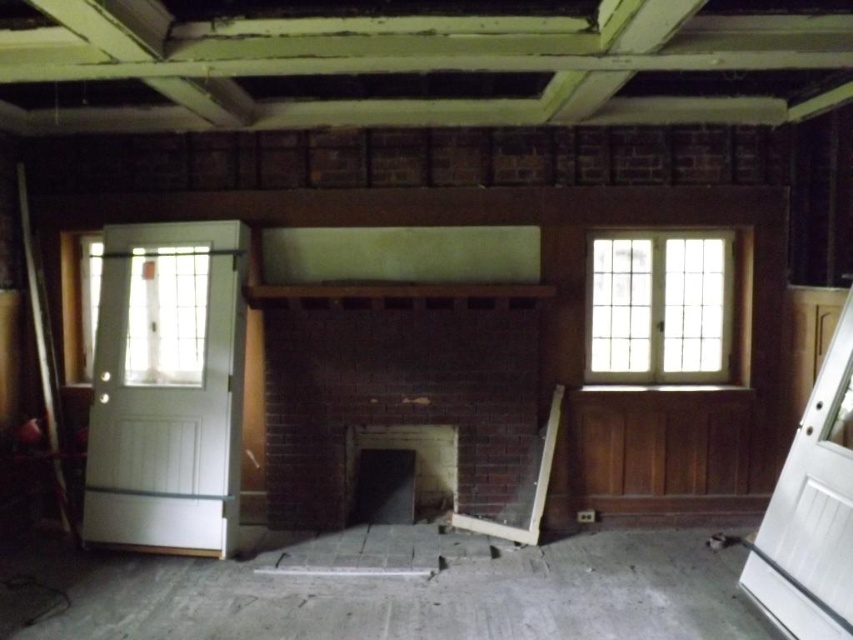
Question: Which point is closer to the camera?

Choices:
 (A) (846, 384)
 (B) (117, 387)
 (C) (16, 180)

Answer: (A)

Question: Is white wood door at right below clear glass window at upper right?

Choices:
 (A) no
 (B) yes

Answer: (B)

Question: Which point is farther to the camera?

Choices:
 (A) white wood door at right
 (B) brick fireplace at center
 (C) clear glass window at upper right

Answer: (C)

Question: Which point is farther from the camera taking this photo?

Choices:
 (A) pos(151,378)
 (B) pos(45,301)

Answer: (B)

Question: Can you confirm if brick fireplace at center is positioned to the left of metallic silver ladder at left?

Choices:
 (A) no
 (B) yes

Answer: (A)

Question: Is brick fireplace at center bigger than clear glass window at upper right?

Choices:
 (A) yes
 (B) no

Answer: (A)